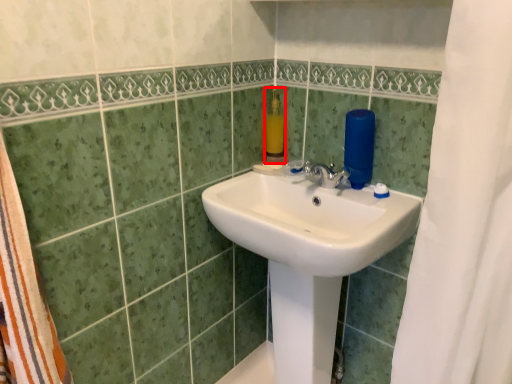
Question: Considering the relative positions of soap dispenser (annotated by the red box) and sink in the image provided, where is soap dispenser (annotated by the red box) located with respect to the staircase?

Choices:
 (A) right
 (B) left

Answer: (B)